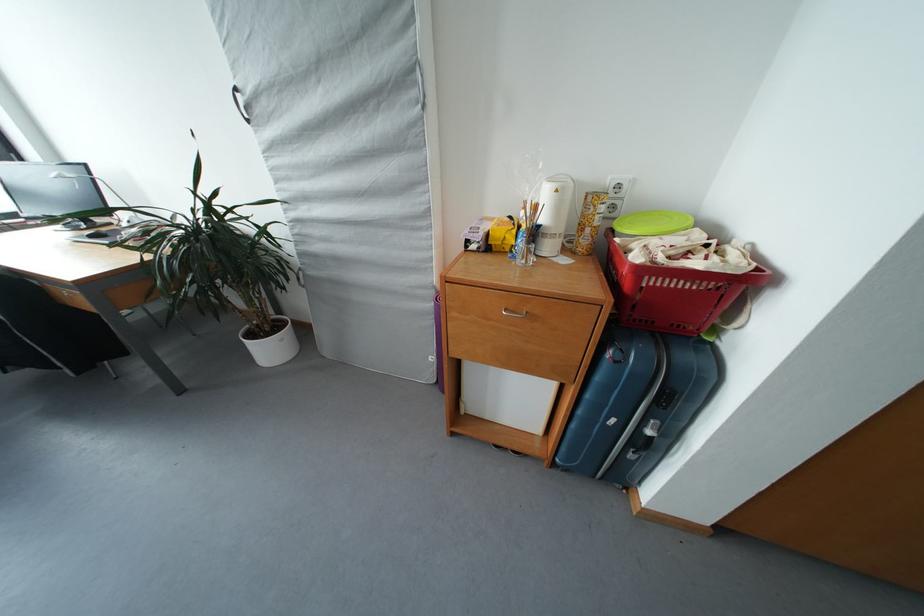
Describe the element at coordinates (648, 432) in the screenshot. This screenshot has height=616, width=924. I see `a blue suitcase handle` at that location.